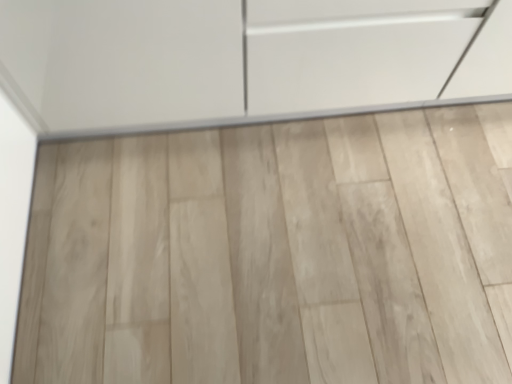
The width and height of the screenshot is (512, 384). I want to click on empty space that is ontop of natural wood plywood at center, so click(x=277, y=236).